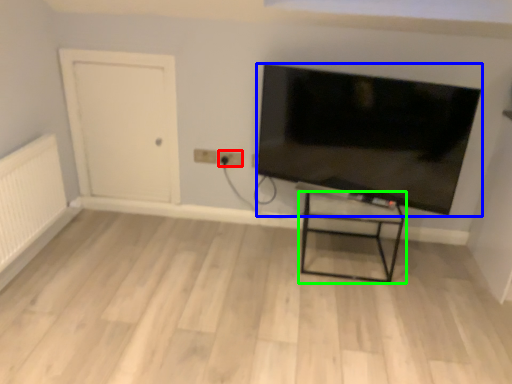
Question: Which is nearer to the electric outlet (highlighted by a red box)? television (highlighted by a blue box) or furniture (highlighted by a green box).

Choices:
 (A) television
 (B) furniture

Answer: (A)